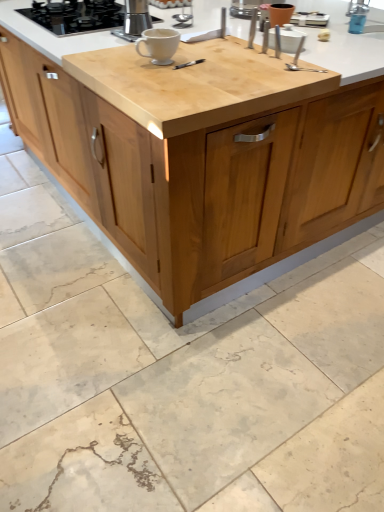
This screenshot has width=384, height=512. Find the location of `matte brown pot at upper right`. matte brown pot at upper right is located at coordinates (280, 14).

This screenshot has width=384, height=512. What do you see at coordinates (280, 14) in the screenshot?
I see `matte brown pot at upper right` at bounding box center [280, 14].

Image resolution: width=384 pixels, height=512 pixels. Describe the element at coordinates (180, 210) in the screenshot. I see `light brown wood cabinet at center` at that location.

At what (x,y) coordinates should I click in order to perform the action: click on black glass gas stove at upper left. Please return your answer as a coordinate pair (x, y). Looking at the image, I should click on (76, 15).

Where is `satin silver espresso maker at upper center`? Image resolution: width=384 pixels, height=512 pixels. satin silver espresso maker at upper center is located at coordinates (136, 17).

What is the approximate width of white glossy mug at center?

The width of white glossy mug at center is 7.22 inches.

What are the coordinates of `blue plastic faucet at upper right` in the screenshot? It's located at (361, 18).

Identify the location of matte brown pot at upper right. The image size is (384, 512). (280, 14).

From the picture: Is satin silver spoon at upper right closer to camera compared to satin silver espresso maker at upper center?

That is True.

Is satin silver espresso maker at upper center completely or partially inside satin silver spoon at upper right?

No, satin silver espresso maker at upper center is not surrounded by satin silver spoon at upper right.

Is satin silver spoon at upper right at the left side of satin silver espresso maker at upper center?

No, satin silver spoon at upper right is not to the left of satin silver espresso maker at upper center.

Is satin silver spoon at upper right oriented towards satin silver espresso maker at upper center?

No, satin silver spoon at upper right is not oriented towards satin silver espresso maker at upper center.

How distant is black glass gas stove at upper left from matte brown pot at upper right?

black glass gas stove at upper left and matte brown pot at upper right are 78.29 centimeters apart from each other.

Is point (57, 18) closer to camera compared to point (271, 26)?

No, it is not.

Image resolution: width=384 pixels, height=512 pixels. In order to click on gas stove lying behind the matte brown pot at upper right in this screenshot , I will do `click(76, 15)`.

Does black glass gas stove at upper left contain matte brown pot at upper right?

No, matte brown pot at upper right is located outside of black glass gas stove at upper left.

Based on the photo, is satin silver spoon at upper right facing towards blue plastic faucet at upper right?

No, satin silver spoon at upper right is not aimed at blue plastic faucet at upper right.

From the image's perspective, who appears lower, satin silver spoon at upper right or blue plastic faucet at upper right?

satin silver spoon at upper right appears lower in the image.

This screenshot has height=512, width=384. I want to click on utensil that is on the left side of blue plastic faucet at upper right, so click(302, 68).

Which of these two, satin silver spoon at upper right or blue plastic faucet at upper right, stands shorter?

Standing shorter between the two is satin silver spoon at upper right.

Between point (371, 183) and point (76, 18), which one is positioned behind?

The point (371, 183) is more distant.

Is the depth of light brown wood cabinet at center less than that of black glass gas stove at upper left?

Yes, it is.

Is light brown wood cabinet at center positioned beyond the bounds of black glass gas stove at upper left?

That's correct, light brown wood cabinet at center is outside of black glass gas stove at upper left.

Is light brown wood cabinet at center not close to black glass gas stove at upper left?

Yes, light brown wood cabinet at center is far from black glass gas stove at upper left.

Between satin silver spoon at upper right and black glass gas stove at upper left, which one is positioned in front?

satin silver spoon at upper right.

Consider the image. Can you confirm if satin silver spoon at upper right is taller than black glass gas stove at upper left?

In fact, satin silver spoon at upper right may be shorter than black glass gas stove at upper left.

Is satin silver spoon at upper right surrounding black glass gas stove at upper left?

No, black glass gas stove at upper left is not inside satin silver spoon at upper right.

Would you consider satin silver spoon at upper right to be distant from black glass gas stove at upper left?

No, satin silver spoon at upper right is not far away from black glass gas stove at upper left.

Between white glossy mug at center and blue plastic faucet at upper right, which one is positioned in front?

white glossy mug at center.

Is white glossy mug at center not inside blue plastic faucet at upper right?

Yes, white glossy mug at center is not within blue plastic faucet at upper right.

Is white glossy mug at center turned away from blue plastic faucet at upper right?

That's right, white glossy mug at center is facing away from blue plastic faucet at upper right.

Is white glossy mug at center next to blue plastic faucet at upper right?

white glossy mug at center is not next to blue plastic faucet at upper right, and they're not touching.

Is matte brown pot at upper right smaller than satin silver spoon at upper right?

No.

From the image's perspective, is matte brown pot at upper right above satin silver spoon at upper right?

Yes.

Is matte brown pot at upper right further to the viewer compared to satin silver spoon at upper right?

Yes, matte brown pot at upper right is behind satin silver spoon at upper right.

Is satin silver spoon at upper right surrounded by matte brown pot at upper right?

Actually, satin silver spoon at upper right is outside matte brown pot at upper right.

Locate an element on the screen. This screenshot has width=384, height=512. utensil in front of the satin silver espresso maker at upper center is located at coordinates (x=302, y=68).

Locate an element on the screen. The width and height of the screenshot is (384, 512). gas stove located above the matte brown pot at upper right (from the image's perspective) is located at coordinates (76, 15).

Based on their spatial positions, is black glass gas stove at upper left or light brown wood cabinet at center further from white glossy mug at center?

light brown wood cabinet at center is further to white glossy mug at center.

In the scene shown: Based on their spatial positions, is light brown wood cabinet at center or satin silver espresso maker at upper center further from satin silver spoon at upper right?

Among the two, satin silver espresso maker at upper center is located further to satin silver spoon at upper right.

When comparing their distances from black glass gas stove at upper left, does light brown wood cabinet at center or satin silver spoon at upper right seem closer?

The object closer to black glass gas stove at upper left is satin silver spoon at upper right.

When comparing their distances from satin silver espresso maker at upper center, does satin silver spoon at upper right or blue plastic faucet at upper right seem closer?

satin silver spoon at upper right lies closer to satin silver espresso maker at upper center than the other object.

Which object lies further to the anchor point matte brown pot at upper right, satin silver espresso maker at upper center or satin silver spoon at upper right?

satin silver espresso maker at upper center is further to matte brown pot at upper right.

Estimate the real-world distances between objects in this image. Which object is further from light brown wood cabinet at center, white glossy mug at center or black glass gas stove at upper left?

black glass gas stove at upper left is positioned further to the anchor light brown wood cabinet at center.

Estimate the real-world distances between objects in this image. Which object is closer to satin silver espresso maker at upper center, black glass gas stove at upper left or matte brown pot at upper right?

Based on the image, black glass gas stove at upper left appears to be nearer to satin silver espresso maker at upper center.

Looking at this image, considering their positions, is satin silver spoon at upper right positioned further to satin silver espresso maker at upper center than light brown wood cabinet at center?

light brown wood cabinet at center is further to satin silver espresso maker at upper center.

The width and height of the screenshot is (384, 512). I want to click on coffee cup situated between black glass gas stove at upper left and satin silver spoon at upper right from left to right, so click(x=159, y=45).

Where is `coffee cup between satin silver espresso maker at upper center and blue plastic faucet at upper right`? This screenshot has width=384, height=512. coffee cup between satin silver espresso maker at upper center and blue plastic faucet at upper right is located at coordinates (159, 45).

Locate an element on the screen. This screenshot has width=384, height=512. appliance between white glossy mug at center and satin silver spoon at upper right in the horizontal direction is located at coordinates (280, 14).

The height and width of the screenshot is (512, 384). Identify the location of cabinetry between white glossy mug at center and blue plastic faucet at upper right in the horizontal direction. (180, 210).